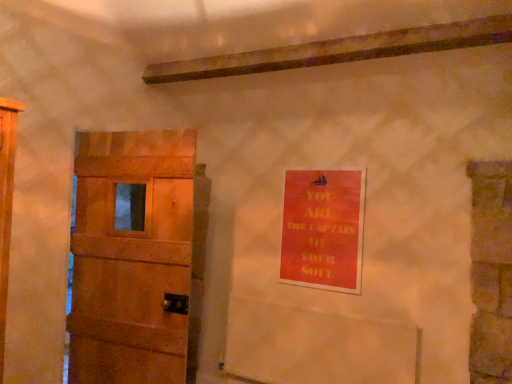
Question: Looking at their shapes, would you say orange matte poster at upper right is wider or thinner than wooden door at left?

Choices:
 (A) thin
 (B) wide

Answer: (A)

Question: Visually, is orange matte poster at upper right positioned to the left or to the right of wooden door at left?

Choices:
 (A) right
 (B) left

Answer: (A)

Question: Is orange matte poster at upper right inside the boundaries of wooden door at left, or outside?

Choices:
 (A) inside
 (B) outside

Answer: (B)

Question: From the image's perspective, is wooden door at left positioned above or below orange matte poster at upper right?

Choices:
 (A) below
 (B) above

Answer: (A)

Question: Would you say wooden door at left is inside or outside orange matte poster at upper right?

Choices:
 (A) outside
 (B) inside

Answer: (A)

Question: Is wooden door at left bigger or smaller than orange matte poster at upper right?

Choices:
 (A) big
 (B) small

Answer: (A)

Question: From a real-world perspective, is wooden door at left positioned above or below orange matte poster at upper right?

Choices:
 (A) below
 (B) above

Answer: (A)